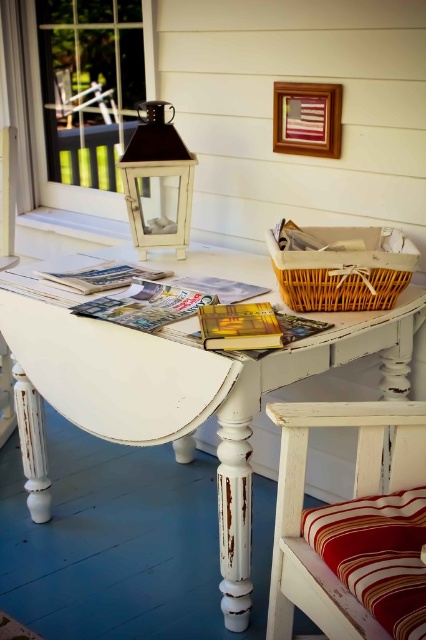
In the scene shown: You are organizing a small event and need to know if the printed paper magazine at center can be placed on the seat of the distressed white wooden chair with striped cushion at lower right without falling off. Based on their sizes, what do you think?

The distressed white wooden chair with striped cushion at lower right is bigger than the printed paper magazine at center, so the magazine can be placed on the chair seat without falling off as the chair is larger in size.

You are sitting on the striped fabric cushion at lower right and want to reach the matte glass lantern at upper center. Can you easily reach it without moving your seat?

The striped fabric cushion at lower right is below the matte glass lantern at upper center, so you can easily reach it without moving your seat.